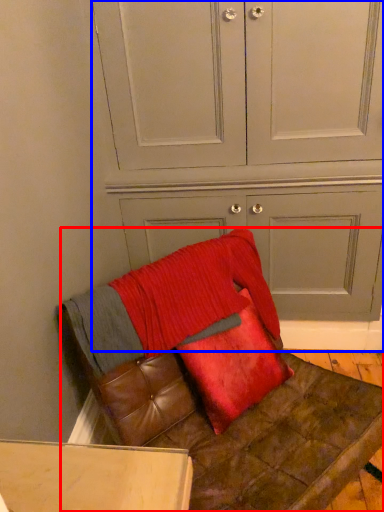
Question: Which object appears closest to the camera in this image, furniture (highlighted by a red box) or dresser (highlighted by a blue box)?

Choices:
 (A) furniture
 (B) dresser

Answer: (A)